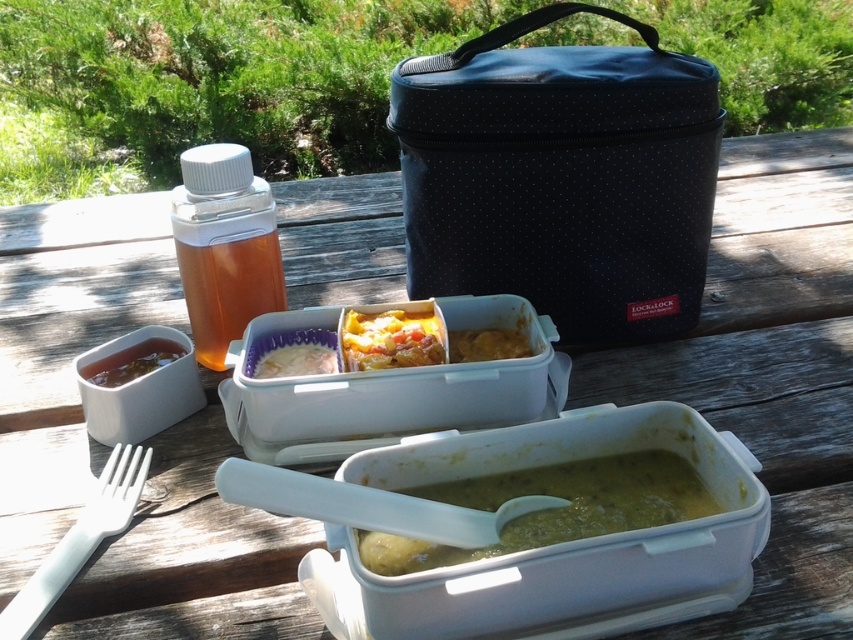
Question: Which point is closer to the camera?

Choices:
 (A) (242, 220)
 (B) (285, 374)
 (C) (302, 483)

Answer: (C)

Question: Which of the following is the closest to the observer?

Choices:
 (A) white plastic fork at lower left
 (B) yellow matte food at center

Answer: (A)

Question: Is white plastic spoon at lower center to the right of yellowish matte food at center from the viewer's perspective?

Choices:
 (A) yes
 (B) no

Answer: (A)

Question: Among these objects, which one is farthest from the camera?

Choices:
 (A) white plastic fork at lower left
 (B) yellow matte food at center
 (C) yellowish matte food at center
 (D) translucent plastic bottle at upper left

Answer: (B)

Question: Can you confirm if translucent plastic bottle at upper left is positioned above white creamy rice at center?

Choices:
 (A) no
 (B) yes

Answer: (B)

Question: Does yellowish matte food at center appear on the left side of white creamy rice at center?

Choices:
 (A) no
 (B) yes

Answer: (A)